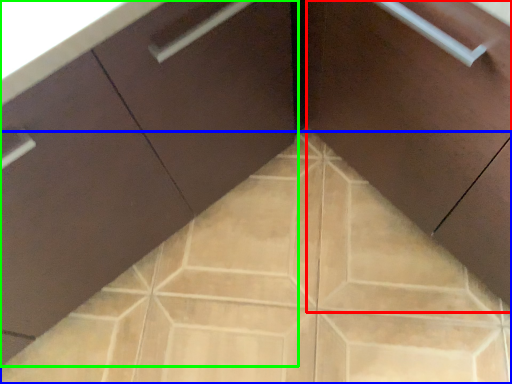
Question: Which is nearer to the cabinetry (highlighted by a red box)? ceramic tile (highlighted by a blue box) or cabinetry (highlighted by a green box).

Choices:
 (A) ceramic tile
 (B) cabinetry

Answer: (B)